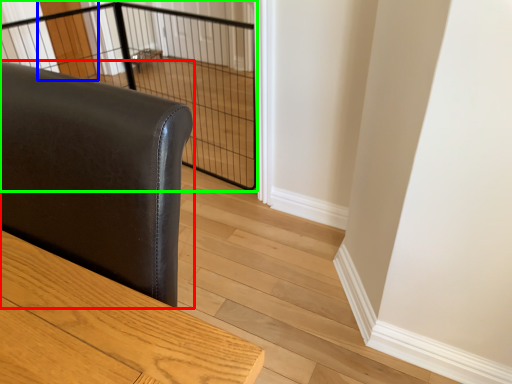
Question: Which is farther away from furniture (highlighted by a red box)? screen door (highlighted by a blue box) or cage (highlighted by a green box)?

Choices:
 (A) screen door
 (B) cage

Answer: (A)